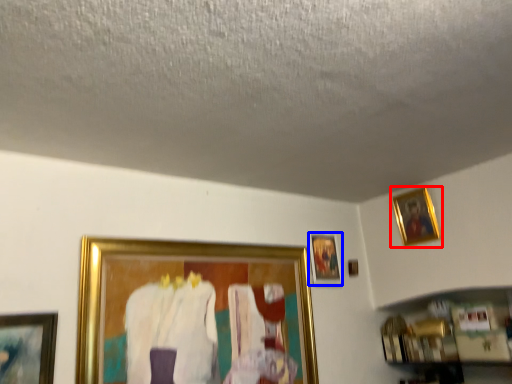
Question: Which object is further to the camera taking this photo, picture frame (highlighted by a red box) or picture frame (highlighted by a blue box)?

Choices:
 (A) picture frame
 (B) picture frame

Answer: (B)